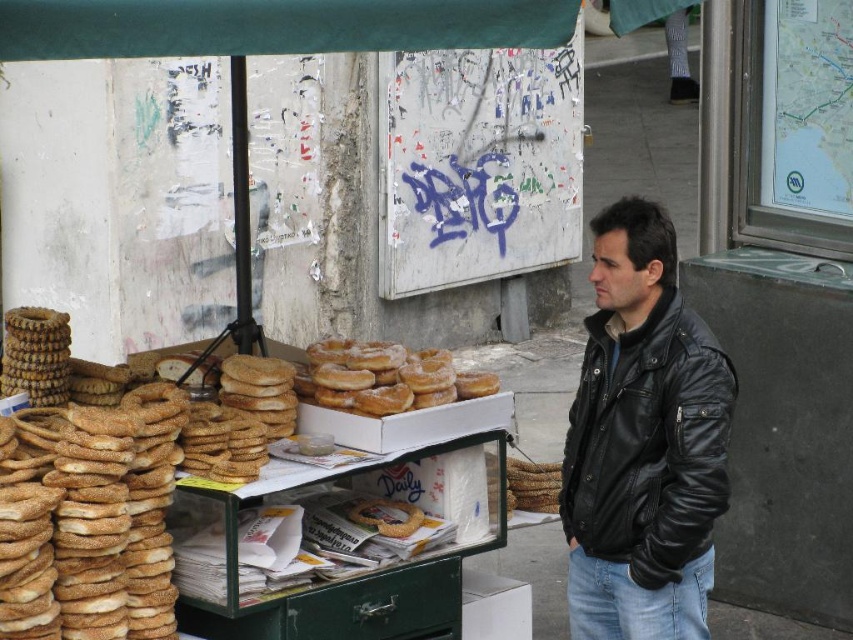
Question: Which object is closer to the camera taking this photo?

Choices:
 (A) slightly toasted bagel at center
 (B) sugared doughnut at center

Answer: (B)

Question: Is sugared doughnut at center bigger than slightly toasted bagel at center?

Choices:
 (A) no
 (B) yes

Answer: (B)

Question: Does sugared doughnut at center have a larger size compared to slightly toasted bagel at center?

Choices:
 (A) yes
 (B) no

Answer: (A)

Question: Which is farther from the sugared doughnut at center?

Choices:
 (A) slightly toasted bagel at center
 (B) black leather jacket at right

Answer: (B)

Question: Does black leather jacket at right have a larger size compared to sugared doughnut at center?

Choices:
 (A) yes
 (B) no

Answer: (A)

Question: Which of the following is the farthest from the observer?

Choices:
 (A) black leather jacket at right
 (B) slightly toasted bagel at center

Answer: (B)